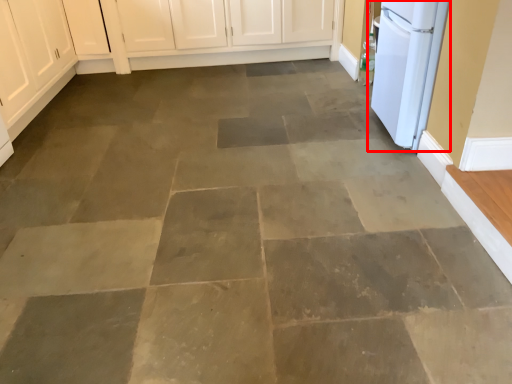
Question: From the image's perspective, where is home appliance (annotated by the red box) located relative to cabinetry?

Choices:
 (A) below
 (B) above

Answer: (A)